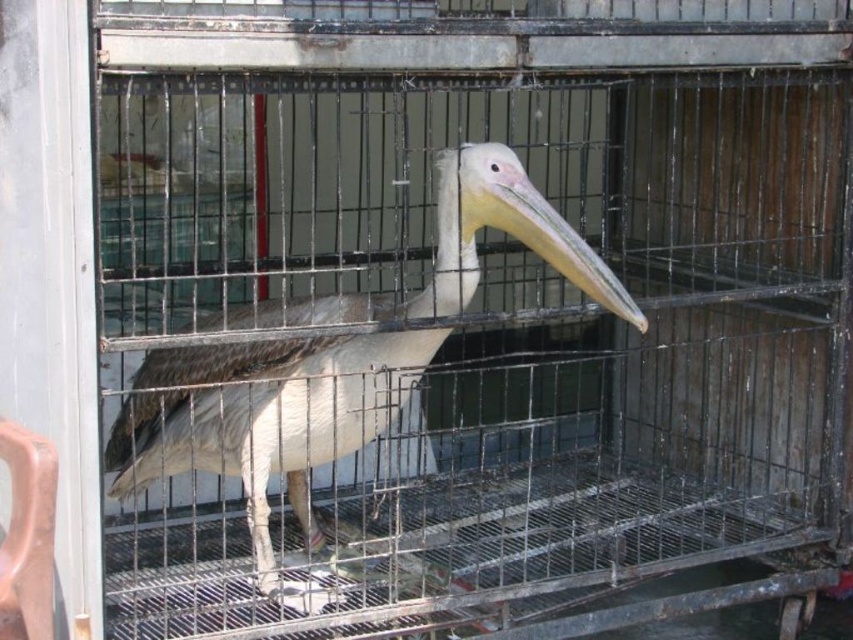
Question: Which point is closer to the camera taking this photo?

Choices:
 (A) (161, 422)
 (B) (543, 227)

Answer: (B)

Question: Does grayish-brown feathers at center lie in front of smooth beige beak at center?

Choices:
 (A) no
 (B) yes

Answer: (B)

Question: Which point is closer to the camera?

Choices:
 (A) smooth beige beak at center
 (B) grayish-brown feathers at center

Answer: (B)

Question: Among these objects, which one is nearest to the camera?

Choices:
 (A) smooth beige beak at center
 (B) grayish-brown feathers at center

Answer: (B)

Question: Considering the relative positions of grayish-brown feathers at center and smooth beige beak at center in the image provided, where is grayish-brown feathers at center located with respect to smooth beige beak at center?

Choices:
 (A) left
 (B) right

Answer: (A)

Question: Is grayish-brown feathers at center smaller than smooth beige beak at center?

Choices:
 (A) yes
 (B) no

Answer: (B)